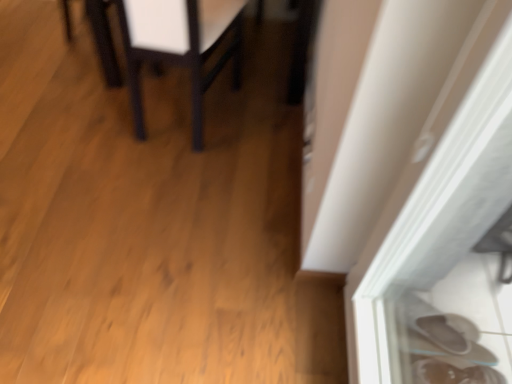
Find the location of a particular element. Image resolution: width=512 pixels, height=384 pixels. vacant position to the left of matte black table at upper left is located at coordinates tap(78, 106).